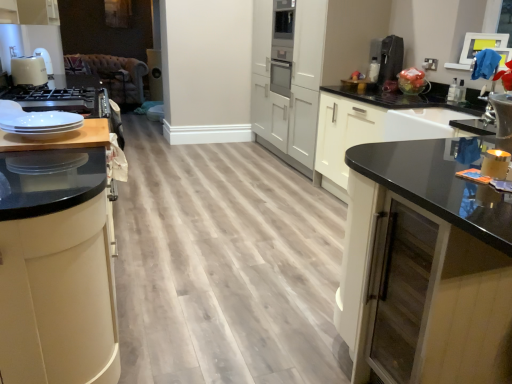
Describe the element at coordinates (112, 74) in the screenshot. I see `brown leather couch at upper left` at that location.

This screenshot has height=384, width=512. In order to click on matte black cabinet at left, which is the second cabinetry from right to left in this screenshot , I will do `click(58, 271)`.

Where is `satin black coffee machine at upper right`? Image resolution: width=512 pixels, height=384 pixels. satin black coffee machine at upper right is located at coordinates pos(390,58).

Where is `brown leather couch at upper left`? brown leather couch at upper left is located at coordinates (112, 74).

Is matte black cabinet at left, positioned as the 1th cabinetry in left-to-right order, bigger or smaller than wooden cutting board at left?

In the image, matte black cabinet at left, positioned as the 1th cabinetry in left-to-right order, appears to be larger than wooden cutting board at left.

This screenshot has width=512, height=384. I want to click on cabinetry that is the 1st object directly below the wooden cutting board at left (from a real-world perspective), so click(58, 271).

From a real-world perspective, is matte black cabinet at left, positioned as the 1th cabinetry in left-to-right order, positioned above or below wooden cutting board at left?

matte black cabinet at left, positioned as the 1th cabinetry in left-to-right order, is situated lower than wooden cutting board at left in the real world.

Is matte black cabinet at left, positioned as the 1th cabinetry in left-to-right order, looking in the opposite direction of wooden cutting board at left?

No, matte black cabinet at left, positioned as the 1th cabinetry in left-to-right order, is not facing the opposite direction of wooden cutting board at left.

Based on the photo, which point is more distant from viewer, [392,50] or [131,99]?

The point [131,99] is farther from the camera.

Is satin black coffee machine at upper right spatially inside brown leather couch at upper left, or outside of it?

satin black coffee machine at upper right is spatially situated outside brown leather couch at upper left.

You are a GUI agent. You are given a task and a screenshot of the screen. Output one action in this format:
    pyautogui.click(x=<x>, y=<y>)
    Task: Click on the coffee machine that appears below the brown leather couch at upper left (from the image's perspective)
    
    Given the screenshot: What is the action you would take?
    pyautogui.click(x=390, y=58)

Who is shorter, wooden cutting board at left or satin black coffee machine at upper right?

wooden cutting board at left.

Does point (21, 148) lie in front of point (395, 35)?

Yes, point (21, 148) is closer to viewer.

Would you say wooden cutting board at left is inside or outside satin black coffee machine at upper right?

The correct answer is: outside.

Is wooden cutting board at left thinner than satin black coffee machine at upper right?

No, wooden cutting board at left is not thinner than satin black coffee machine at upper right.

In terms of width, does brown leather couch at upper left look wider or thinner when compared to satin black coffee machine at upper right?

brown leather couch at upper left is wider than satin black coffee machine at upper right.

Based on the photo, is brown leather couch at upper left not inside satin black coffee machine at upper right?

brown leather couch at upper left is positioned outside satin black coffee machine at upper right.

From the picture: Is brown leather couch at upper left next to satin black coffee machine at upper right and touching it?

No, brown leather couch at upper left is not beside satin black coffee machine at upper right.

This screenshot has width=512, height=384. Find the location of `brown behind the satin black coffee machine at upper right`. brown behind the satin black coffee machine at upper right is located at coordinates (112, 74).

Between black glass cabinet at right, the second cabinetry when ordered from left to right, and wooden cutting board at left, which one appears on the left side from the viewer's perspective?

From the viewer's perspective, wooden cutting board at left appears more on the left side.

Considering the sizes of objects black glass cabinet at right, the second cabinetry when ordered from left to right, and wooden cutting board at left in the image provided, who is shorter, black glass cabinet at right, the second cabinetry when ordered from left to right, or wooden cutting board at left?

Standing shorter between the two is wooden cutting board at left.

In the image, is black glass cabinet at right, the second cabinetry when ordered from left to right, positioned in front of or behind wooden cutting board at left?

black glass cabinet at right, the second cabinetry when ordered from left to right, is positioned closer to the viewer than wooden cutting board at left.

You are a GUI agent. You are given a task and a screenshot of the screen. Output one action in this format:
    pyautogui.click(x=<x>, y=<y>)
    Task: Click on the brown behind the wooden cutting board at left
    The height and width of the screenshot is (384, 512).
    Given the screenshot: What is the action you would take?
    pyautogui.click(x=112, y=74)

In the scene shown: Can you confirm if brown leather couch at upper left is positioned to the right of wooden cutting board at left?

No.

Is brown leather couch at upper left inside or outside of wooden cutting board at left?

The correct answer is: outside.

Considering the positions of objects brown leather couch at upper left and wooden cutting board at left in the image provided, who is in front, brown leather couch at upper left or wooden cutting board at left?

wooden cutting board at left is closer to the camera.

In the image, is wooden cutting board at left positioned in front of or behind black glass cabinet at right, the second cabinetry when ordered from left to right?

wooden cutting board at left is positioned farther from the viewer than black glass cabinet at right, the second cabinetry when ordered from left to right.

Does wooden cutting board at left turn towards black glass cabinet at right, the second cabinetry when ordered from left to right?

No, wooden cutting board at left is not turned towards black glass cabinet at right, the second cabinetry when ordered from left to right.

Is wooden cutting board at left positioned far away from black glass cabinet at right, the second cabinetry when ordered from left to right?

Yes, wooden cutting board at left and black glass cabinet at right, the second cabinetry when ordered from left to right, are located far from each other.

Where is `countertop lying above the black glass cabinet at right, placed as the first cabinetry when sorted from right to left (from the image's perspective)`? countertop lying above the black glass cabinet at right, placed as the first cabinetry when sorted from right to left (from the image's perspective) is located at coordinates (61, 138).

From the image's perspective, count 1st cabinetrys downward from the wooden cutting board at left and point to it. Please provide its 2D coordinates.

[(58, 271)]

Locate an element on the screen. brown below the satin black coffee machine at upper right (from a real-world perspective) is located at coordinates (112, 74).

When comparing their distances from satin black coffee machine at upper right, does wooden cutting board at left or matte black cabinet at left, which is the second cabinetry from right to left, seem closer?

Among the two, wooden cutting board at left is located nearer to satin black coffee machine at upper right.

From the image, which object appears to be farther from black glass cabinet at right, placed as the first cabinetry when sorted from right to left, satin black coffee machine at upper right or wooden cutting board at left?

Based on the image, satin black coffee machine at upper right appears to be further to black glass cabinet at right, placed as the first cabinetry when sorted from right to left.

Looking at the image, which one is located closer to wooden cutting board at left, matte black cabinet at left, positioned as the 1th cabinetry in left-to-right order, or brown leather couch at upper left?

matte black cabinet at left, positioned as the 1th cabinetry in left-to-right order, is positioned closer to the anchor wooden cutting board at left.

When comparing their distances from satin black coffee machine at upper right, does brown leather couch at upper left or black glass cabinet at right, placed as the first cabinetry when sorted from right to left, seem closer?

The object closer to satin black coffee machine at upper right is black glass cabinet at right, placed as the first cabinetry when sorted from right to left.

Estimate the real-world distances between objects in this image. Which object is further from satin black coffee machine at upper right, black glass cabinet at right, the second cabinetry when ordered from left to right, or matte black cabinet at left, which is the second cabinetry from right to left?

matte black cabinet at left, which is the second cabinetry from right to left.

From the image, which object appears to be nearer to matte black cabinet at left, positioned as the 1th cabinetry in left-to-right order, satin black coffee machine at upper right or wooden cutting board at left?

wooden cutting board at left.

Which object lies further to the anchor point brown leather couch at upper left, matte black cabinet at left, positioned as the 1th cabinetry in left-to-right order, or satin black coffee machine at upper right?

matte black cabinet at left, positioned as the 1th cabinetry in left-to-right order, is positioned further to the anchor brown leather couch at upper left.

When comparing their distances from black glass cabinet at right, the second cabinetry when ordered from left to right, does matte black cabinet at left, which is the second cabinetry from right to left, or wooden cutting board at left seem closer?

matte black cabinet at left, which is the second cabinetry from right to left, is positioned closer to the anchor black glass cabinet at right, the second cabinetry when ordered from left to right.

You are a GUI agent. You are given a task and a screenshot of the screen. Output one action in this format:
    pyautogui.click(x=<x>, y=<y>)
    Task: Click on the countertop situated between matte black cabinet at left, which is the second cabinetry from right to left, and black glass cabinet at right, placed as the first cabinetry when sorted from right to left, from left to right
    
    Given the screenshot: What is the action you would take?
    pyautogui.click(x=61, y=138)

I want to click on countertop between black glass cabinet at right, placed as the first cabinetry when sorted from right to left, and brown leather couch at upper left, along the z-axis, so click(x=61, y=138).

In order to click on countertop between black glass cabinet at right, the second cabinetry when ordered from left to right, and satin black coffee machine at upper right, along the z-axis in this screenshot , I will do `click(61, 138)`.

The height and width of the screenshot is (384, 512). What are the coordinates of `cabinetry between black glass cabinet at right, placed as the first cabinetry when sorted from right to left, and brown leather couch at upper left from front to back` in the screenshot? It's located at (58, 271).